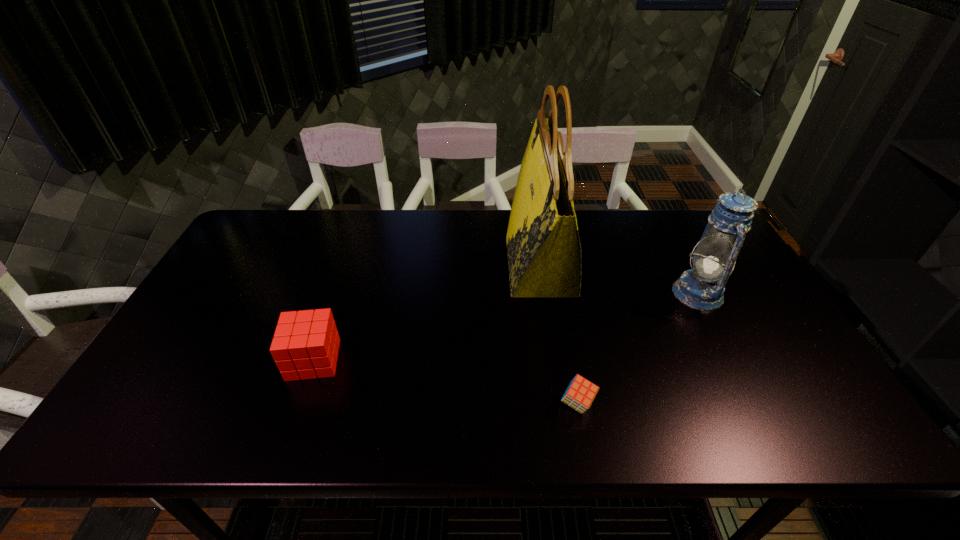
At what (x,y) coordinates should I click in order to perform the action: click on blank region between the lantern and the tallest object. Please return your answer as a coordinate pair (x, y). This screenshot has height=540, width=960. Looking at the image, I should click on (619, 279).

Locate an element on the screen. The width and height of the screenshot is (960, 540). vacant area between the left cube and the tallest object is located at coordinates (427, 313).

Locate an element on the screen. empty space that is in between the tallest object and the third tallest object is located at coordinates (427, 313).

The height and width of the screenshot is (540, 960). Find the location of `free area in between the nearer cube and the taller cube`. free area in between the nearer cube and the taller cube is located at coordinates (445, 382).

Identify the location of object that is the closest one to the third shortest object. (544, 252).

Image resolution: width=960 pixels, height=540 pixels. Identify the location of object that can be found as the second closest to the nearer cube. (702, 287).

Find the location of a particular element. This screenshot has width=960, height=540. vacant space that satisfies the following two spatial constraints: 1. on the front side of the taller cube; 2. on the right side of the right cube is located at coordinates (299, 404).

This screenshot has width=960, height=540. What are the coordinates of `vacant area that satisfies the following two spatial constraints: 1. on the front-facing side of the tallest object; 2. on the front side of the taller cube` in the screenshot? It's located at (555, 360).